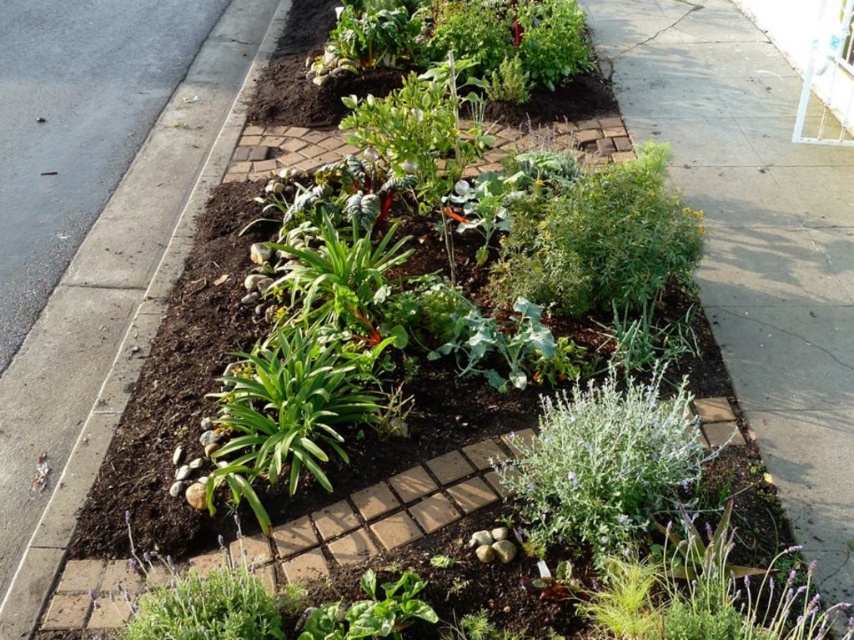
Is gray asphalt at lower left above silvery-green leafy plant at lower right?

Indeed, gray asphalt at lower left is positioned over silvery-green leafy plant at lower right.

Who is higher up, gray asphalt at lower left or silvery-green leafy plant at lower right?

Positioned higher is gray asphalt at lower left.

Describe the element at coordinates (75, 124) in the screenshot. I see `gray asphalt at lower left` at that location.

Identify the location of gray asphalt at lower left. (75, 124).

Does gray asphalt at lower left appear over green leafy plant at center?

Yes.

Is gray asphalt at lower left positioned behind green leafy plant at center?

Yes.

Between point (132, 122) and point (281, 460), which one is positioned in front?

Positioned in front is point (281, 460).

Find the location of `gray asphalt at lower left`. gray asphalt at lower left is located at coordinates (75, 124).

Describe the element at coordinates (756, 243) in the screenshot. I see `green leafy plant at lower right` at that location.

Is green leafy plant at lower right bigger than green leafy plant at center?

Yes, green leafy plant at lower right is bigger than green leafy plant at center.

Who is more distant from viewer, (773,65) or (284,435)?

The point (773,65) is more distant.

At what (x,y) coordinates should I click in order to perform the action: click on green leafy plant at lower right. Please return your answer as a coordinate pair (x, y). Looking at the image, I should click on (756, 243).